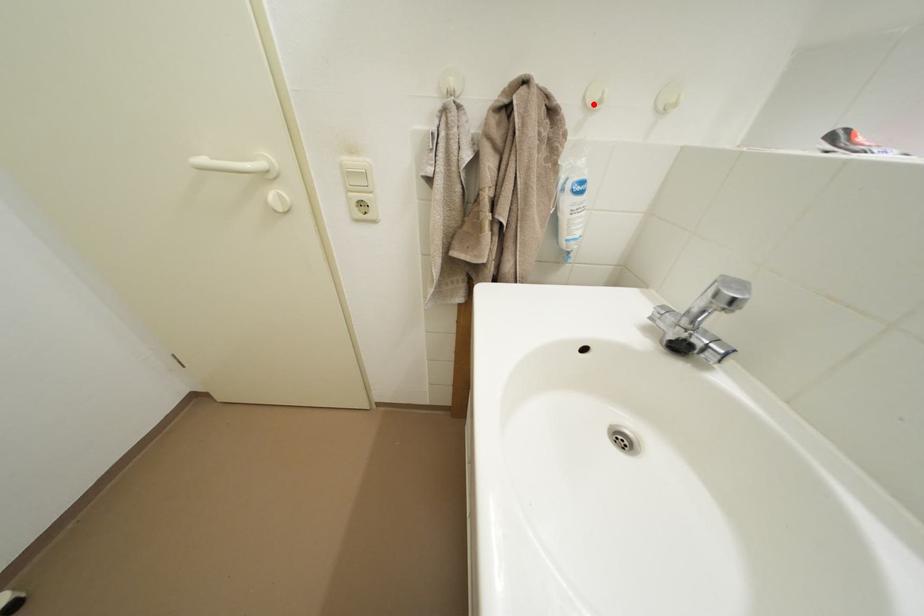
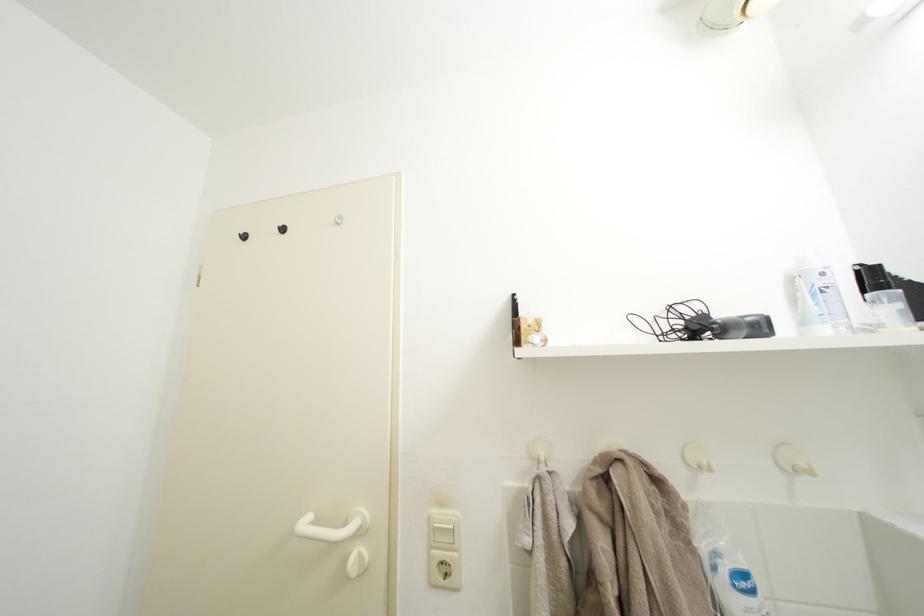
Where in the second image is the point corresponding to the highlighted location from the first image?

(694, 464)